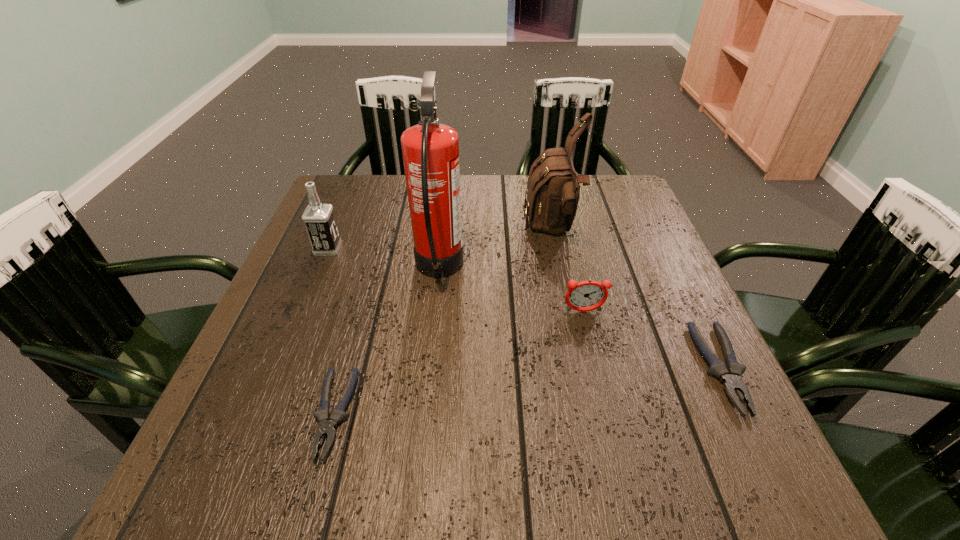
What are the coordinates of `object that is at the near right corner` in the screenshot? It's located at (730, 375).

Identify the location of vacant space at the far edge of the desktop. (481, 185).

In order to click on vacant region at the near edge of the desktop in this screenshot , I will do `click(404, 429)`.

Image resolution: width=960 pixels, height=540 pixels. What are the coordinates of `vacant space at the left edge` in the screenshot? It's located at (239, 376).

Where is `blank space at the right edge of the desktop`? blank space at the right edge of the desktop is located at coordinates (669, 320).

Image resolution: width=960 pixels, height=540 pixels. In the image, there is a desktop. In order to click on vacant region at the far left corner in this screenshot , I will do `click(372, 176)`.

The height and width of the screenshot is (540, 960). What are the coordinates of `vacant space at the far right corner of the desktop` in the screenshot? It's located at (612, 209).

Locate an element on the screen. free space between the tallest object and the shoulder bag is located at coordinates (496, 250).

At what (x,y) coordinates should I click in order to perform the action: click on unoccupied position between the third object from left to right and the second tallest object. Please return your answer as a coordinate pair (x, y). Looking at the image, I should click on (496, 250).

Where is `vacant area that lies between the alarm clock and the fifth shortest object`? The image size is (960, 540). vacant area that lies between the alarm clock and the fifth shortest object is located at coordinates (568, 271).